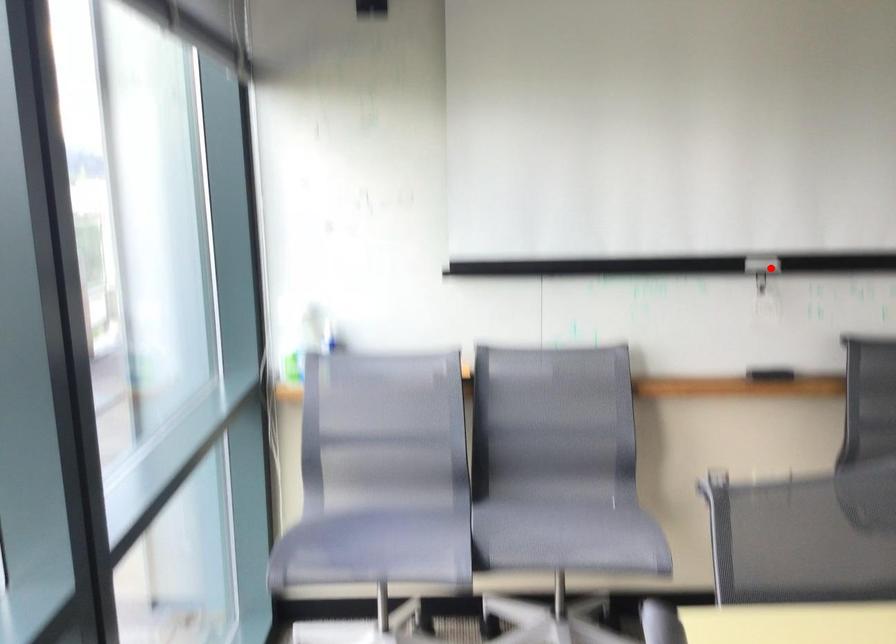
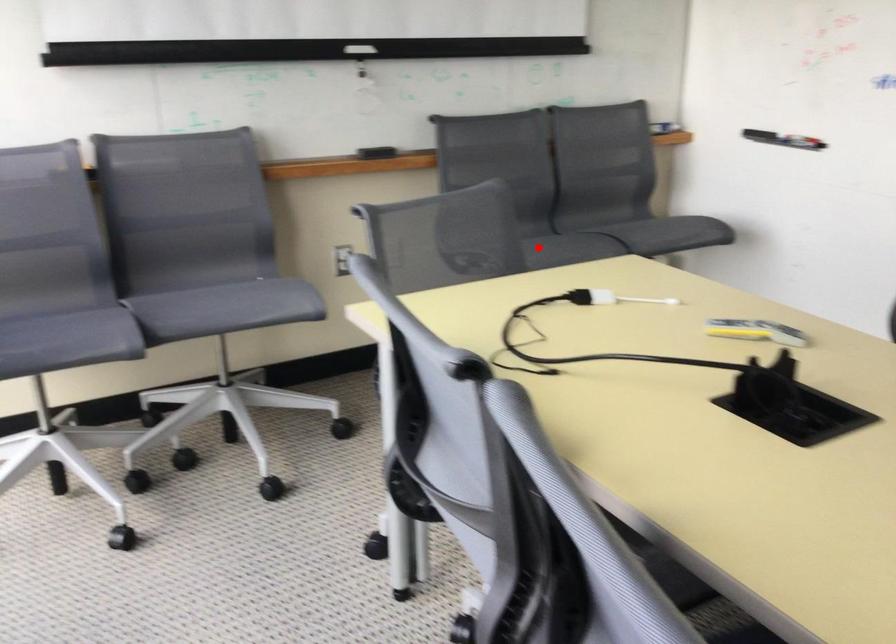
I am providing you with two images of the same scene from different viewpoints. A red point is marked on the first image and another point is marked on the second image. Do the highlighted points in image1 and image2 indicate the same real-world spot?

No